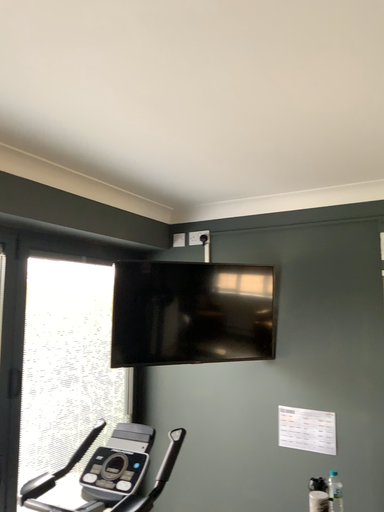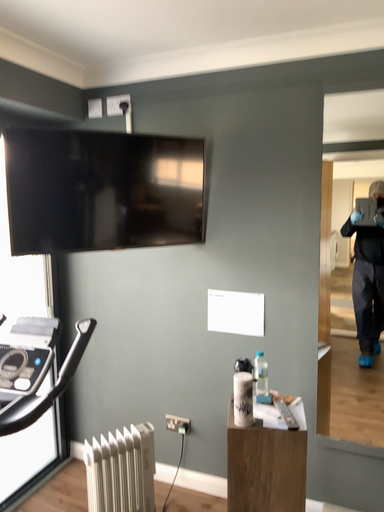
Question: How did the camera likely rotate when shooting the video?

Choices:
 (A) rotated right
 (B) rotated left

Answer: (A)